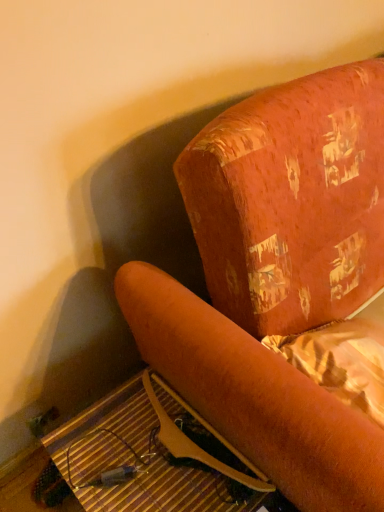
Identify the location of vacant area on top of wooden at lower left (from a real-world perspective). This screenshot has height=512, width=384. (157, 441).